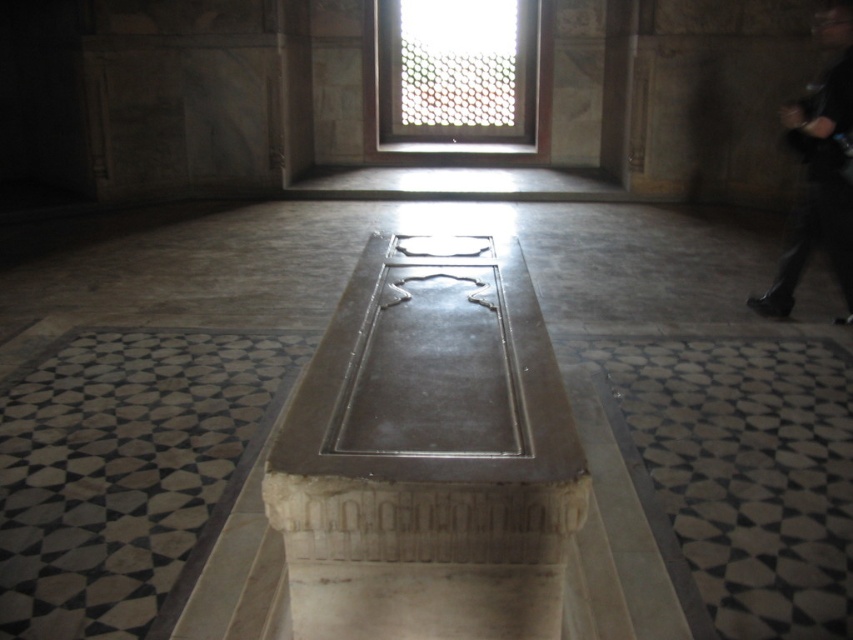
Question: Is polished stone sarcophagus at center smaller than clear glass lattice at upper center?

Choices:
 (A) no
 (B) yes

Answer: (B)

Question: Is polished stone sarcophagus at center positioned before black fabric at right?

Choices:
 (A) yes
 (B) no

Answer: (A)

Question: Which point appears farthest from the camera in this image?

Choices:
 (A) (408, 308)
 (B) (807, 202)
 (C) (531, 38)

Answer: (C)

Question: Which point appears closest to the camera in this image?

Choices:
 (A) (485, 605)
 (B) (831, 113)
 (C) (463, 83)

Answer: (A)

Question: Is polished stone sarcophagus at center closer to the viewer compared to clear glass lattice at upper center?

Choices:
 (A) yes
 (B) no

Answer: (A)

Question: Which point is closer to the camera?

Choices:
 (A) black fabric at right
 (B) polished stone sarcophagus at center

Answer: (B)